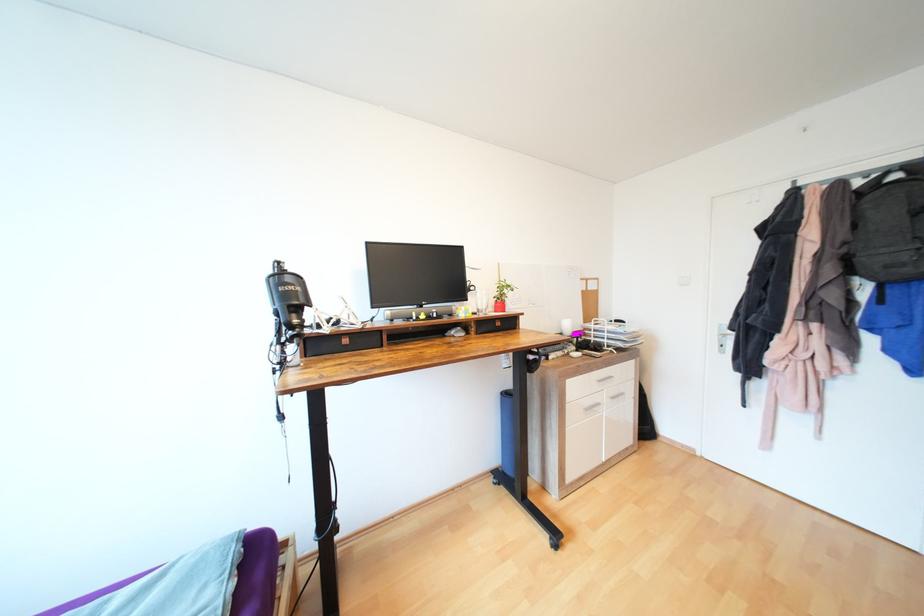
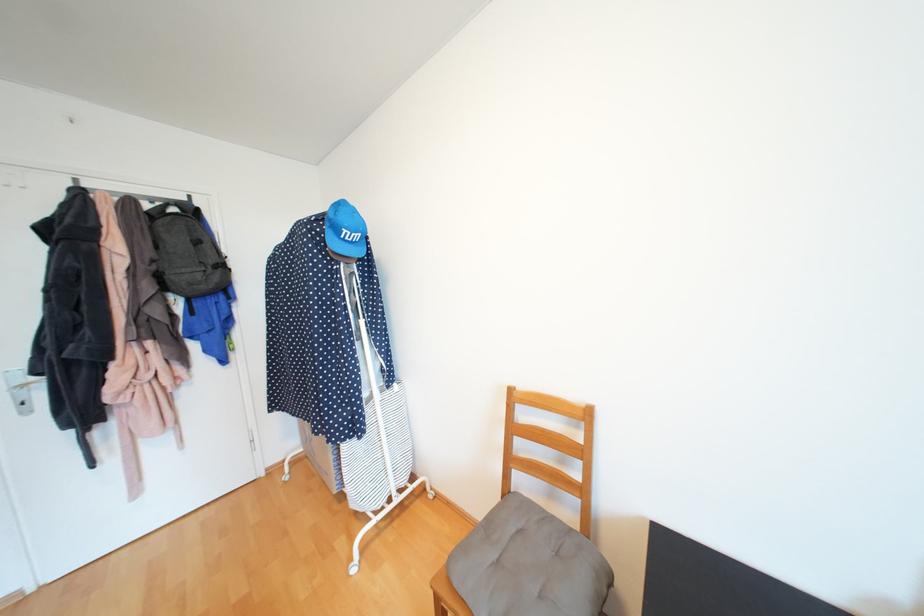
Question: The camera is either moving clockwise (left) or counter-clockwise (right) around the object. The first image is from the beginning of the video and the second image is from the end. Is the camera moving left or right when shooting the video?

Choices:
 (A) Left
 (B) Right

Answer: (A)